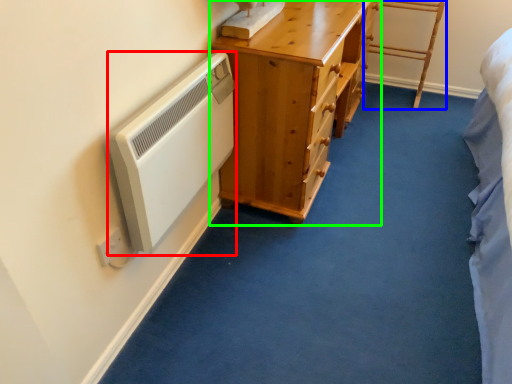
Question: Based on their relative distances, which object is farther from appliance (highlighted by a red box)? Choose from furniture (highlighted by a blue box) and chest of drawers (highlighted by a green box).

Choices:
 (A) furniture
 (B) chest of drawers

Answer: (A)